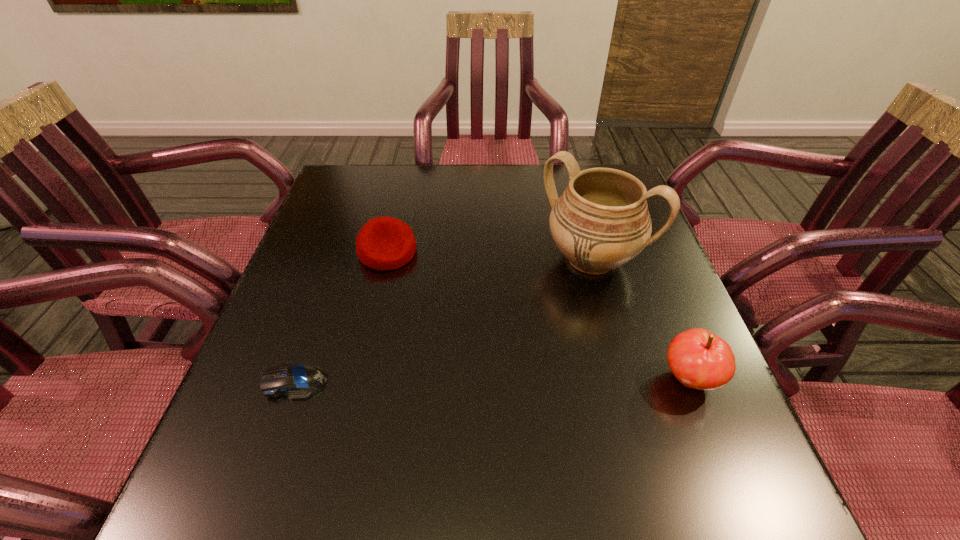
The height and width of the screenshot is (540, 960). What are the coordinates of `computer mouse` in the screenshot? It's located at (296, 380).

Locate an element on the screen. The height and width of the screenshot is (540, 960). apple is located at coordinates (699, 359).

This screenshot has height=540, width=960. What are the coordinates of `the tallest object` in the screenshot? It's located at (601, 221).

Find the location of a particular element. The image size is (960, 540). the third tallest object is located at coordinates (384, 243).

Locate an element on the screen. The image size is (960, 540). free location located on the left of the apple is located at coordinates (602, 379).

Identify the location of free space located 0.190m on the front-facing side of the urn. (517, 337).

Locate an element on the screen. This screenshot has width=960, height=540. vacant space situated on the front-facing side of the urn is located at coordinates (466, 395).

This screenshot has width=960, height=540. Identify the location of blank space located 0.170m on the front-facing side of the urn. (523, 330).

You are a GUI agent. You are given a task and a screenshot of the screen. Output one action in this format:
    pyautogui.click(x=<x>, y=<y>)
    Task: Click on the vacant space located 0.210m on the seat area of the second shortest object
    The width and height of the screenshot is (960, 540).
    Given the screenshot: What is the action you would take?
    point(451,322)

Where is `free location located on the seat area of the second shortest object`? The height and width of the screenshot is (540, 960). free location located on the seat area of the second shortest object is located at coordinates (442, 310).